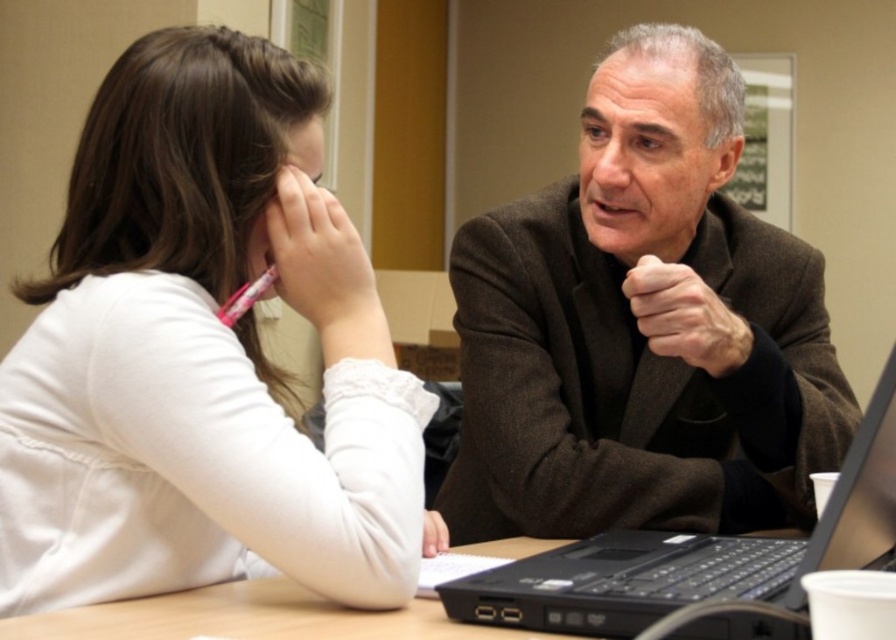
Can you confirm if white matte shirt at left is positioned to the right of white matte hand at lower center?

Incorrect, white matte shirt at left is not on the right side of white matte hand at lower center.

Can you confirm if white matte shirt at left is positioned below white matte hand at lower center?

Incorrect, white matte shirt at left is not positioned below white matte hand at lower center.

The height and width of the screenshot is (640, 896). What are the coordinates of `white matte shirt at left` in the screenshot? It's located at (203, 353).

Identify the location of white matte shirt at left. click(x=203, y=353).

Which is in front, point (700, 342) or point (434, 528)?

Point (434, 528) is in front.

Is brown leather hand at center below white matte hand at lower center?

Actually, brown leather hand at center is above white matte hand at lower center.

What do you see at coordinates (685, 316) in the screenshot? I see `brown leather hand at center` at bounding box center [685, 316].

Locate an element on the screen. brown leather hand at center is located at coordinates click(685, 316).

Is pink matte pen at upper left to the right of white matte hand at lower center from the viewer's perspective?

No, pink matte pen at upper left is not to the right of white matte hand at lower center.

Who is positioned more to the right, pink matte pen at upper left or white matte hand at lower center?

white matte hand at lower center

Does point (272, 230) lie in front of point (421, 552)?

That is True.

Where is `pink matte pen at upper left`? The width and height of the screenshot is (896, 640). pink matte pen at upper left is located at coordinates (306, 220).